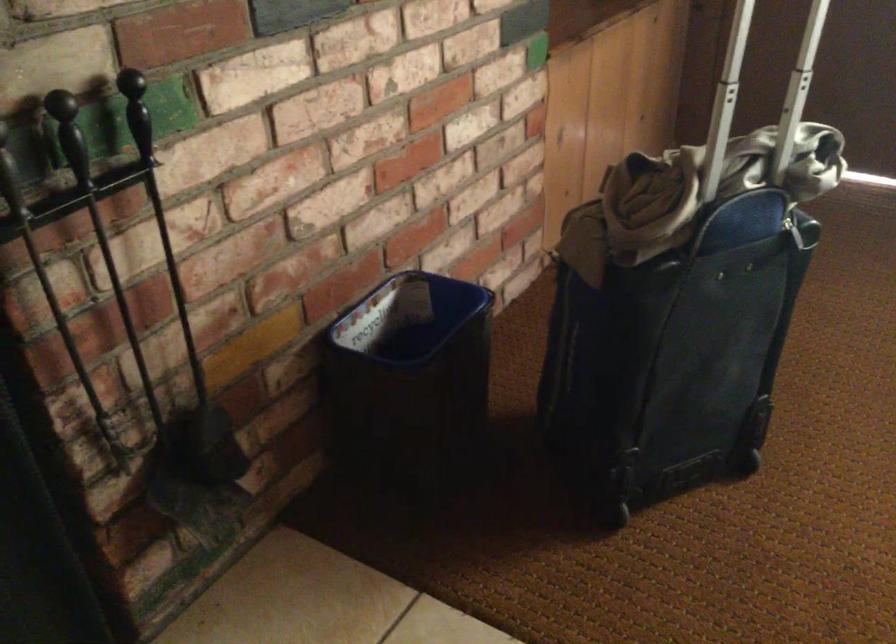
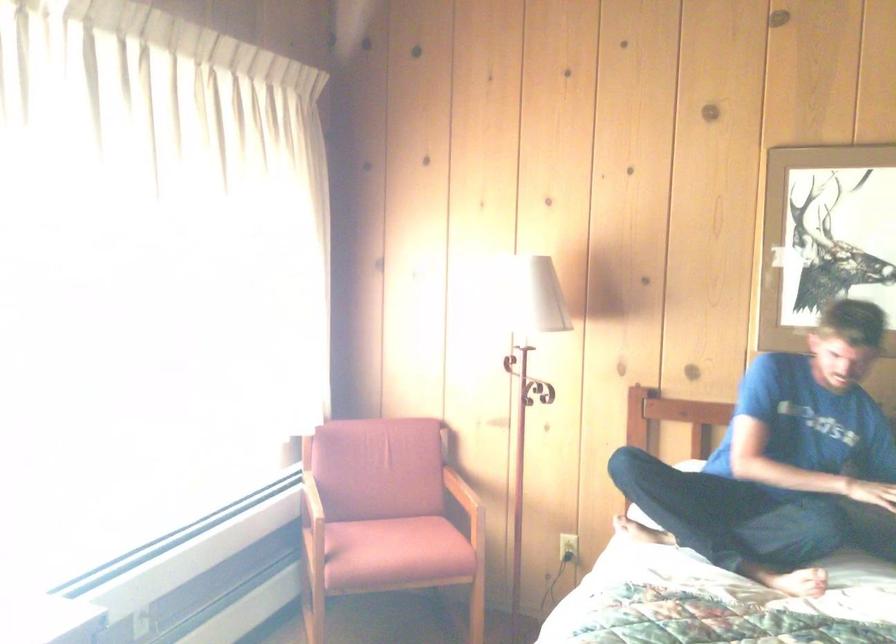
Question: The camera is either moving clockwise (left) or counter-clockwise (right) around the object. The first image is from the beginning of the video and the second image is from the end. Is the camera moving left or right when shooting the video?

Choices:
 (A) Left
 (B) Right

Answer: (A)